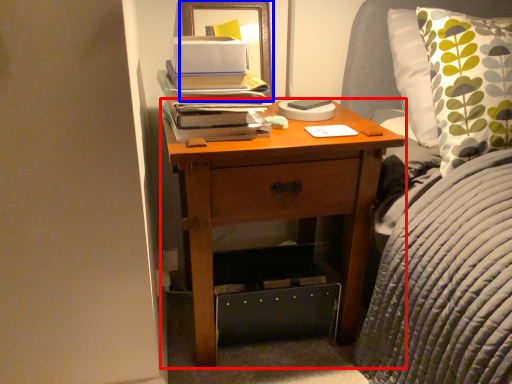
Question: Which object appears farthest to the camera in this image, nightstand (highlighted by a red box) or picture frame (highlighted by a blue box)?

Choices:
 (A) nightstand
 (B) picture frame

Answer: (B)